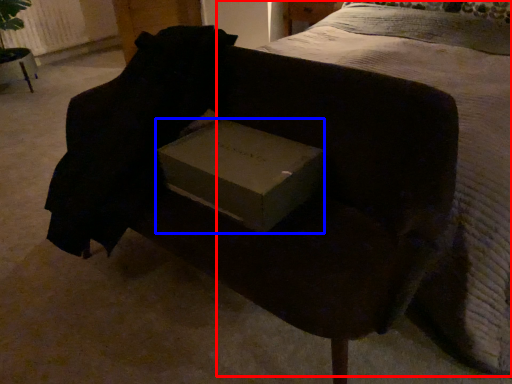
Question: Which object appears farthest to the camera in this image, bed (highlighted by a red box) or box (highlighted by a blue box)?

Choices:
 (A) bed
 (B) box

Answer: (B)